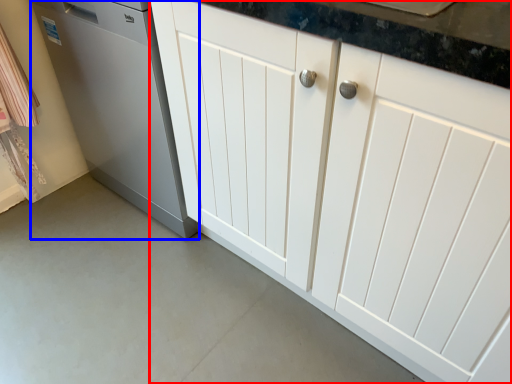
Question: Which point is further to the camera, cabinetry (highlighted by a red box) or home appliance (highlighted by a blue box)?

Choices:
 (A) cabinetry
 (B) home appliance

Answer: (B)